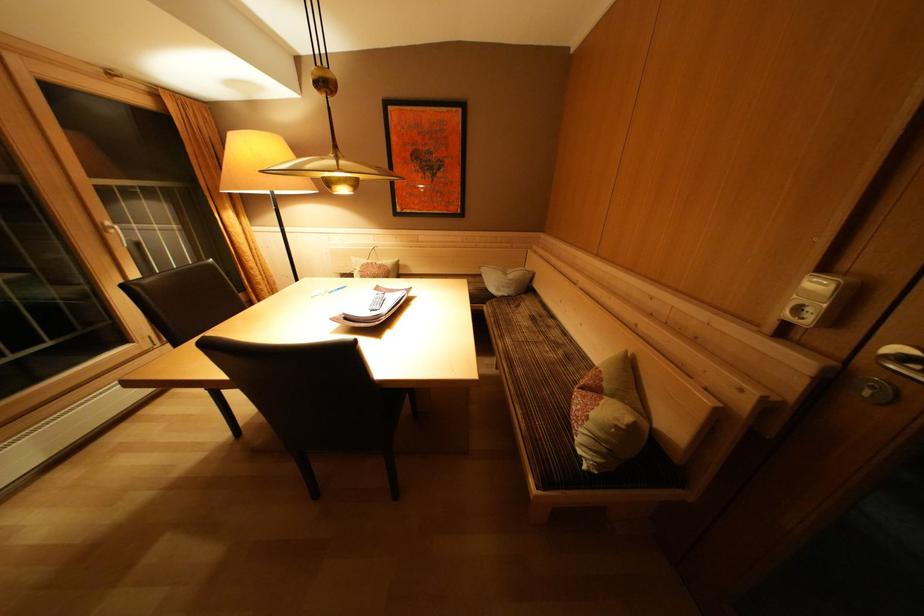
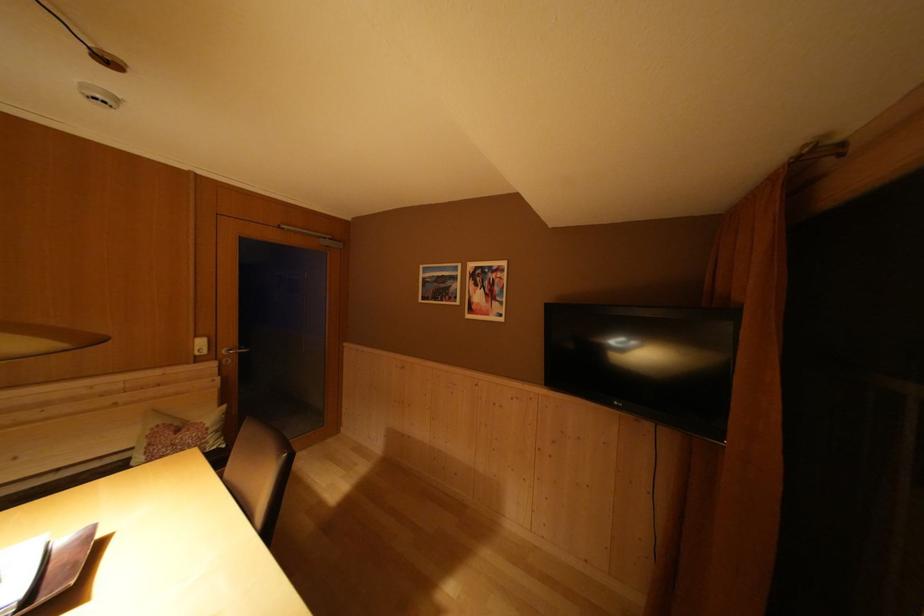
Where in the second image is the point corresponding to pixel 831 275 from the first image?

(203, 342)